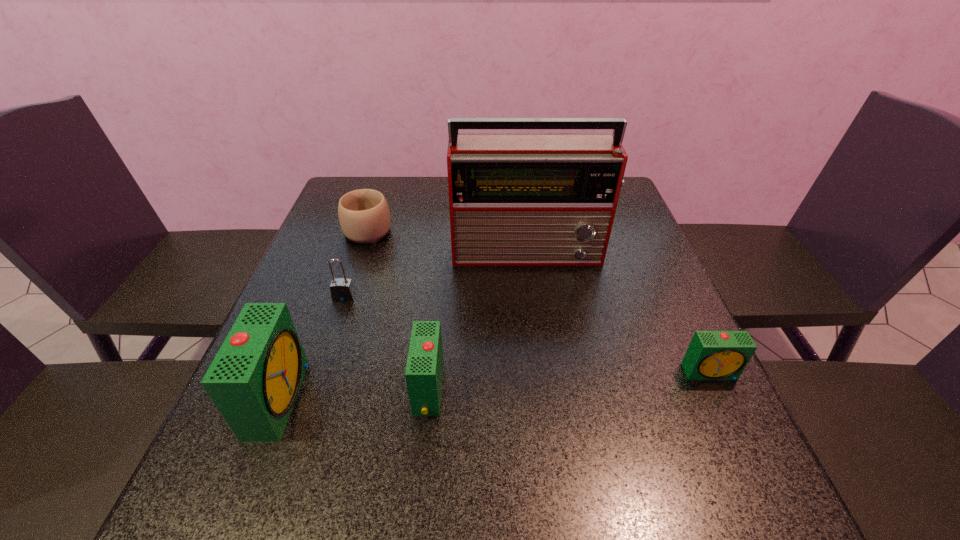
Please point a location where one more alarm_clock can be added evenly. Please provide its 2D coordinates. Your answer should be formatted as a tuple, i.e. [(x, y)], where the tuple contains the x and y coordinates of a point satisfying the conditions above.

[(571, 381)]